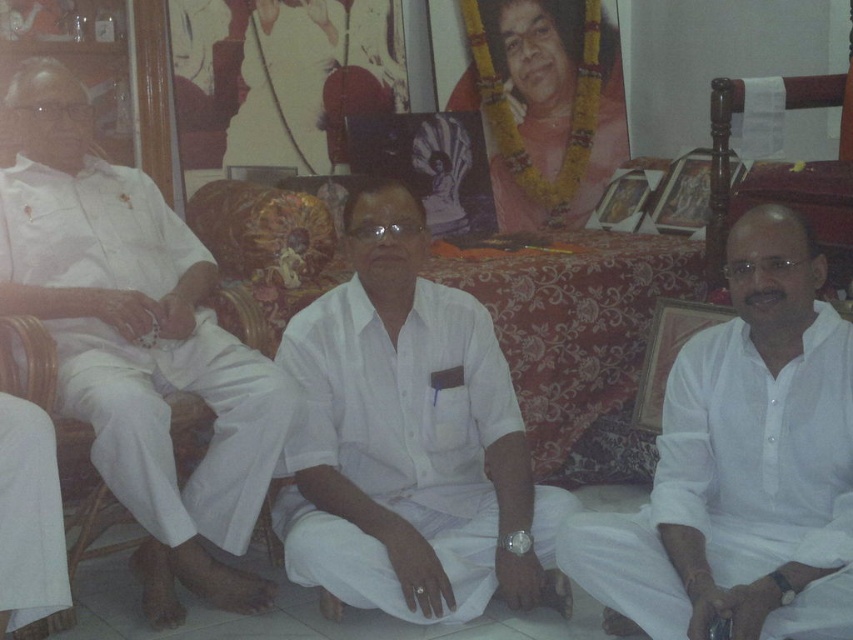
Question: Does white cotton shirt at center appear on the left side of white cotton robe at lower left?

Choices:
 (A) yes
 (B) no

Answer: (B)

Question: Does white cotton shirt at center appear on the right side of white cotton shirt at right?

Choices:
 (A) no
 (B) yes

Answer: (A)

Question: Can you confirm if white cotton kurta at left is positioned to the right of white cotton robe at lower left?

Choices:
 (A) no
 (B) yes

Answer: (B)

Question: Which point is closer to the camera?

Choices:
 (A) (517, 424)
 (B) (759, 492)
 (C) (194, 285)
 (D) (12, 442)

Answer: (D)

Question: Based on their relative distances, which object is nearer to the white cotton shirt at right?

Choices:
 (A) white cotton shirt at center
 (B) white cotton kurta at left

Answer: (A)

Question: Which object is the farthest from the white cotton shirt at right?

Choices:
 (A) white cotton shirt at center
 (B) white cotton robe at lower left
 (C) white cotton kurta at left

Answer: (B)